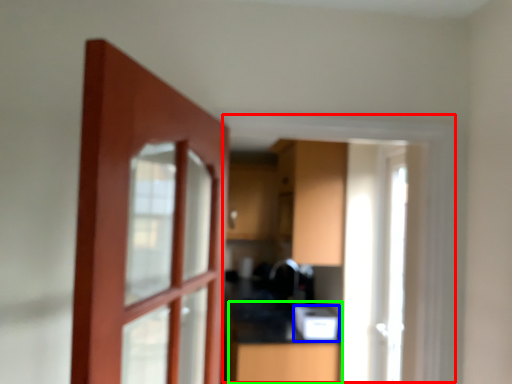
Question: Based on their relative distances, which object is farther from window frame (highlighted by a red box)? Choose from appliance (highlighted by a blue box) and counter (highlighted by a green box).

Choices:
 (A) appliance
 (B) counter

Answer: (B)